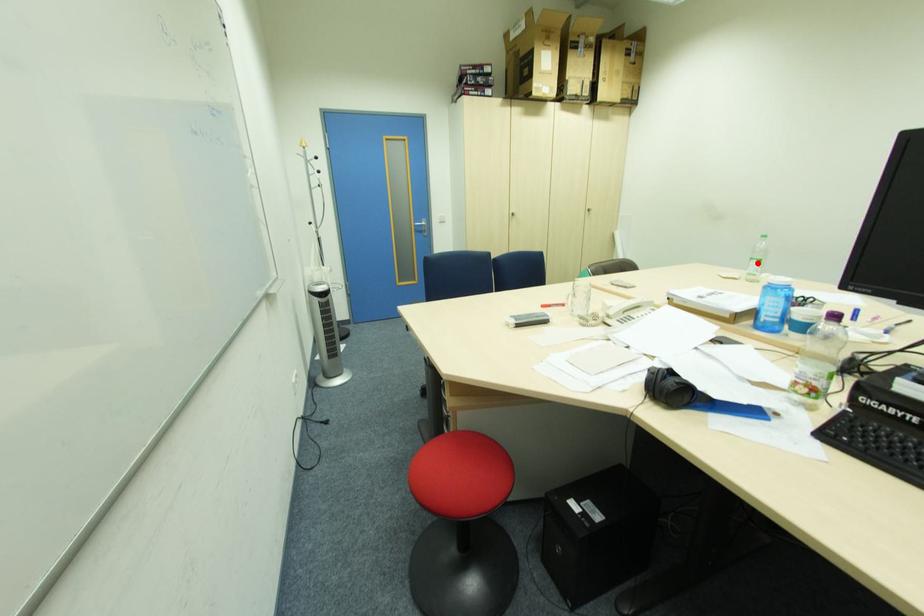
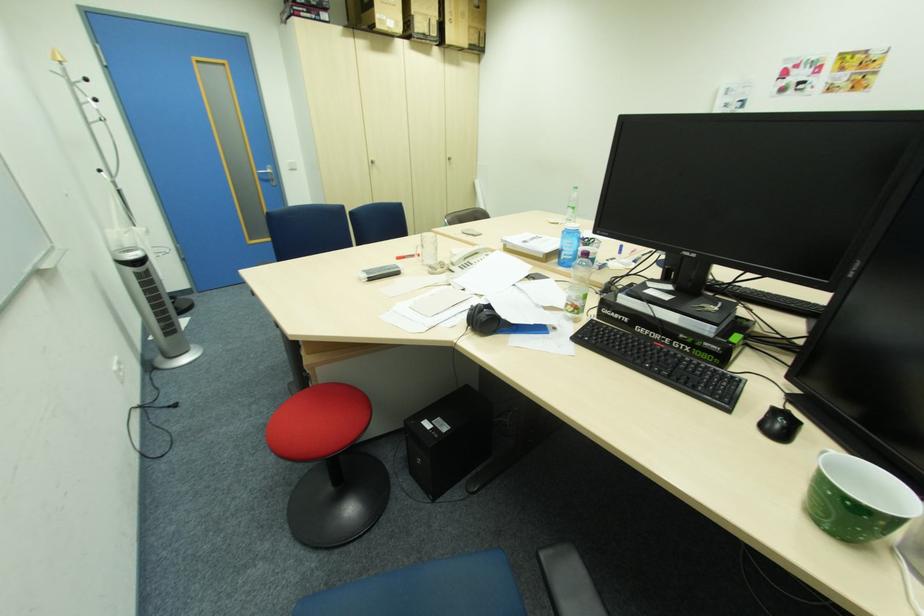
Question: A red point is marked in image1. In image2, is the corresponding 3D point closer to the camera or farther? Reply with the corresponding letter.

Choices:
 (A) The corresponding 3D point is closer.
 (B) The corresponding 3D point is farther.

Answer: (A)